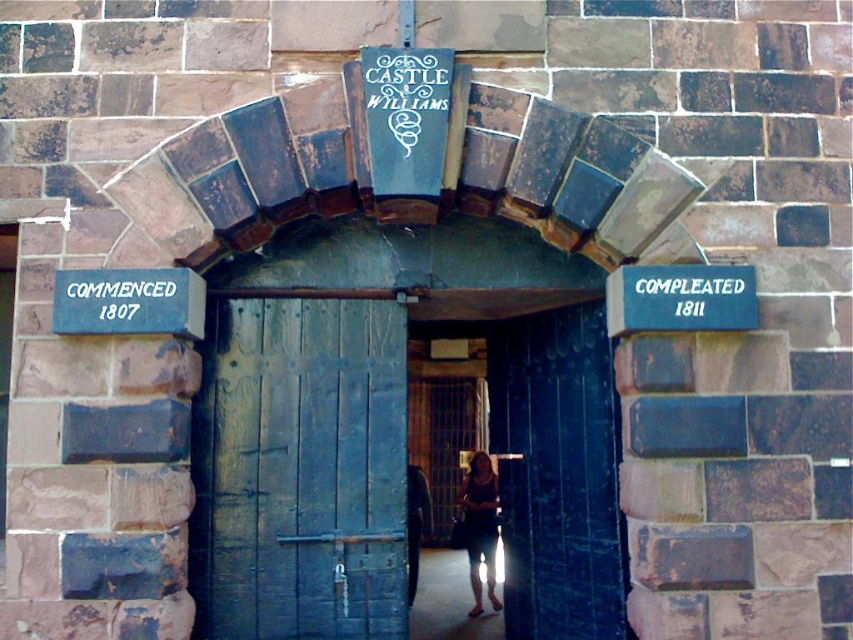
Question: Observing the image, what is the correct spatial positioning of smooth dark wood door at center in reference to blue painted wood sign at right?

Choices:
 (A) right
 (B) left

Answer: (B)

Question: Which point is farther to the camera?

Choices:
 (A) (683, 310)
 (B) (285, 474)
 (C) (373, 632)
 (D) (170, 298)

Answer: (B)

Question: Can you confirm if dark blue wood door at center is wider than blue painted wood sign at right?

Choices:
 (A) no
 (B) yes

Answer: (B)

Question: Based on their relative distances, which object is farther from the smooth dark wood door at center?

Choices:
 (A) blue painted wood sign at left
 (B) blue painted wood sign at right

Answer: (A)

Question: Does smooth dark wood door at center appear under blue painted wood sign at left?

Choices:
 (A) yes
 (B) no

Answer: (A)

Question: Which object appears closest to the camera in this image?

Choices:
 (A) blue painted wood sign at right
 (B) blue painted wood sign at left
 (C) dark blue wood door at center
 (D) smooth dark wood door at center

Answer: (B)